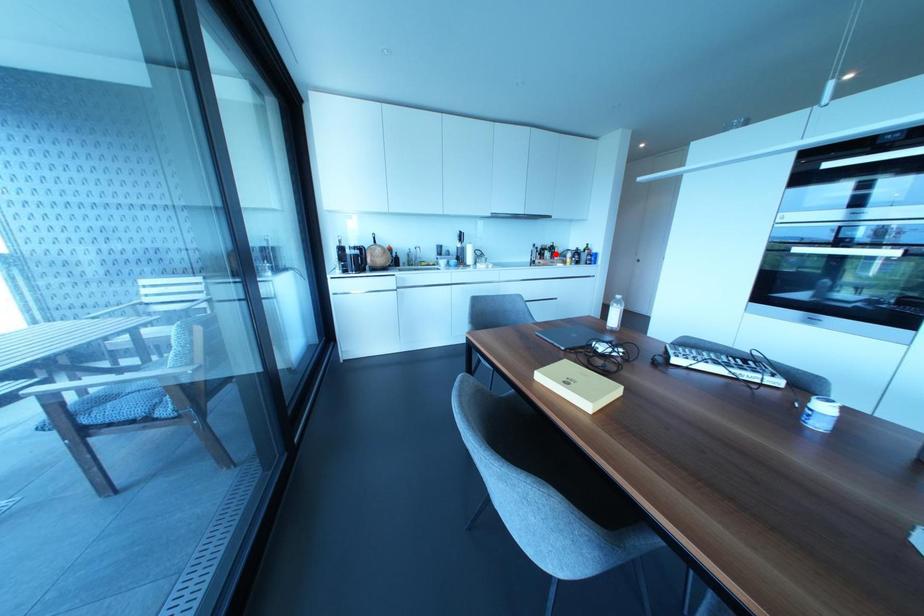
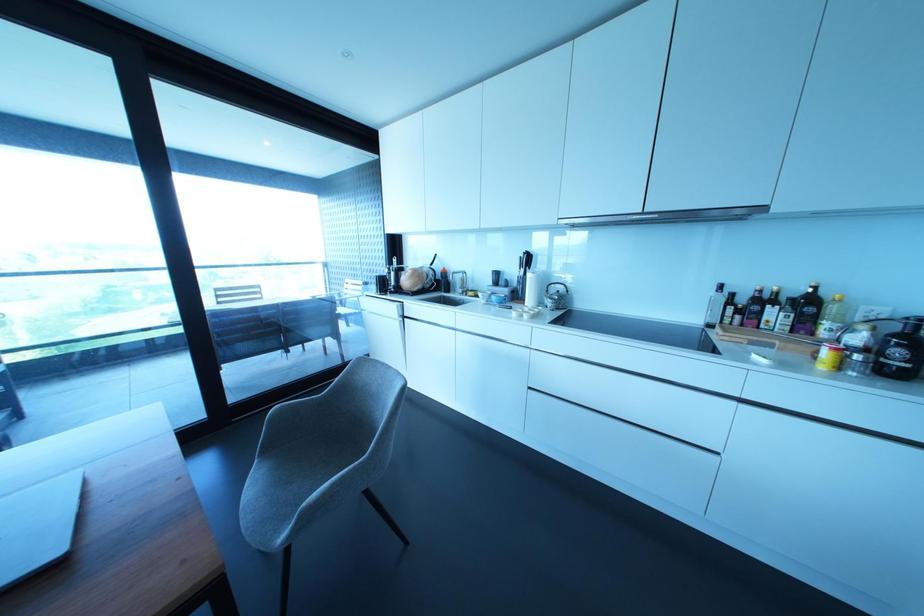
Question: I am providing you with two images of the same scene from different viewpoints. Image1 has a red point marked. In image2, the corresponding 3D location appears at what relative position? Reply with the corresponding letter.

Choices:
 (A) Closer
 (B) Farther

Answer: (B)